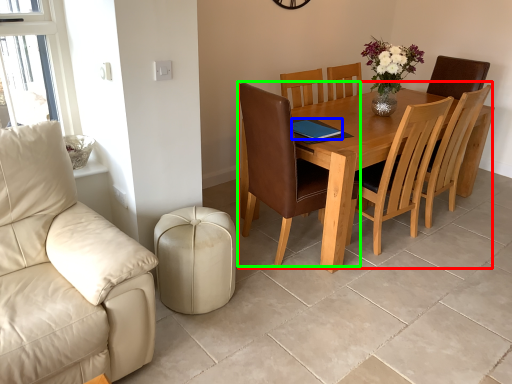
Question: Which is farther away from kitchen & dining room table (highlighted by a red box)? pad (highlighted by a blue box) or chair (highlighted by a green box)?

Choices:
 (A) pad
 (B) chair

Answer: (A)